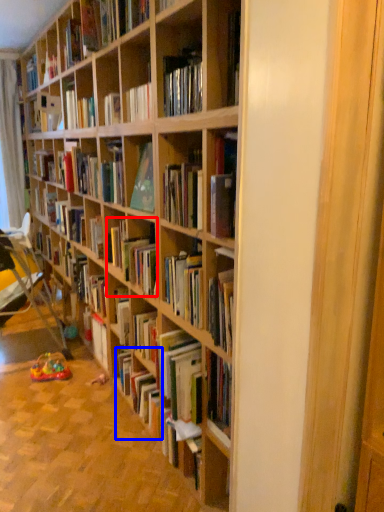
Question: Which of the following is the farthest to the observer, book (highlighted by a red box) or book (highlighted by a blue box)?

Choices:
 (A) book
 (B) book

Answer: (A)